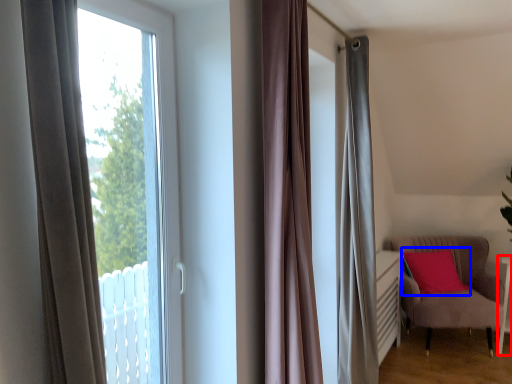
Question: Which of the following is the farthest to the observer, side table (highlighted by a red box) or pillow (highlighted by a blue box)?

Choices:
 (A) side table
 (B) pillow

Answer: (B)